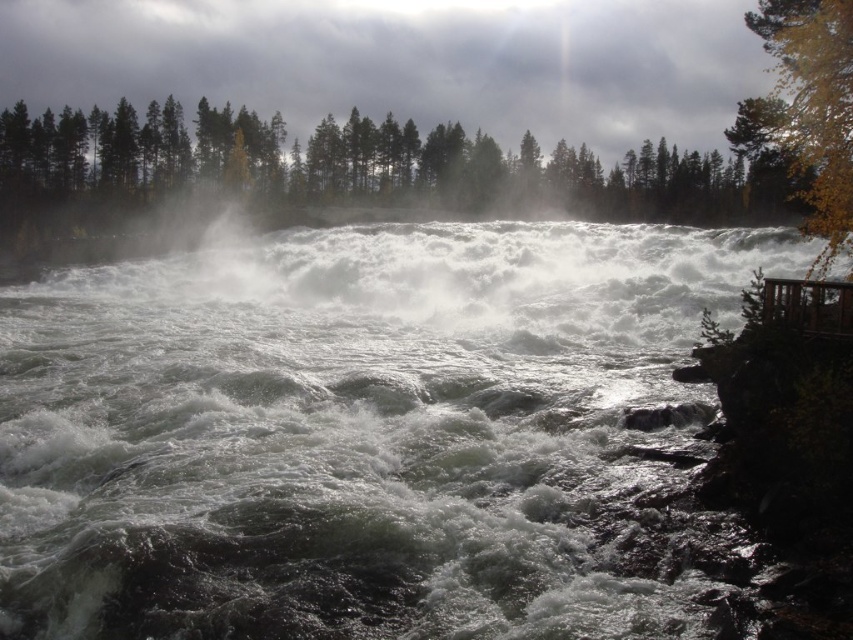
You are standing at the edge of the river and want to cross to the other side. There is a wooden structure to your right. Can you safely step onto the wooden structure to avoid the white frothy water at center?

The white frothy water at center is located at point (354, 432), which suggests it is centrally positioned in the river. Since the wooden structure is on the right side, it is likely positioned away from the frothy water, so stepping onto it would help avoid the turbulent area. However, ensure the structure is stable before crossing.

You are standing at the edge of the river and see two points in the image. One is labeled as point [340,586] and the other as point [846,202]. Which point is nearer to you?

Point [340,586] is closer to the viewer than point [846,202].

You are a photographer trying to capture the white frothy water at center and the yellow leafy tree at right in the same frame. Based on their positions, which object should you adjust your camera to focus on first to ensure both are in the shot?

The white frothy water at center is positioned on the left side of the yellow leafy tree at right, so you should focus on the yellow leafy tree at right first to ensure both are included in the frame.